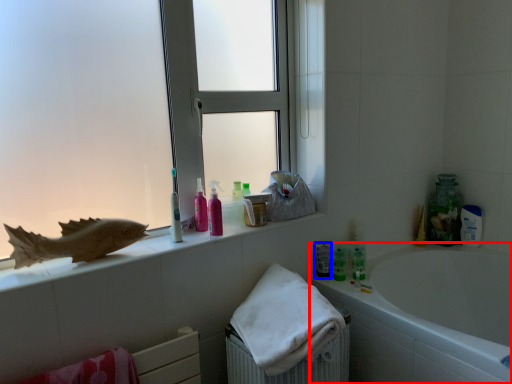
Question: Which object is further to the camera taking this photo, bathtub (highlighted by a red box) or mouthwash (highlighted by a blue box)?

Choices:
 (A) bathtub
 (B) mouthwash

Answer: (B)